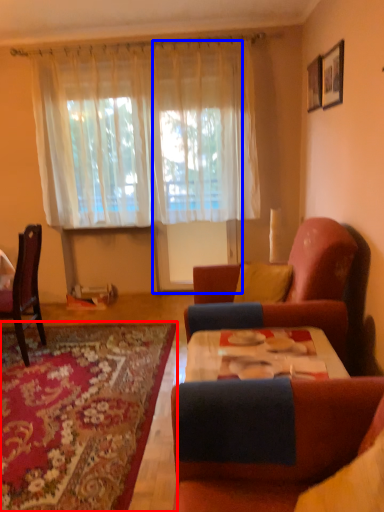
Question: Which object appears closest to the camera in this image, mat (highlighted by a red box) or glass door (highlighted by a blue box)?

Choices:
 (A) mat
 (B) glass door

Answer: (A)